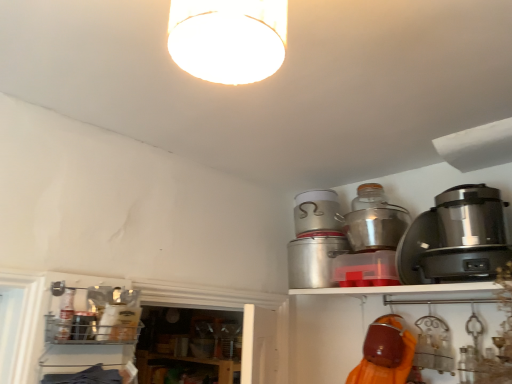
Question: Considering the relative positions of brushed metal canister at lower left, the fourth appliance viewed from the right, and metallic silver pot at upper center, the 2th appliance positioned from the right, in the image provided, is brushed metal canister at lower left, the fourth appliance viewed from the right, to the right of metallic silver pot at upper center, the 2th appliance positioned from the right, from the viewer's perspective?

Choices:
 (A) no
 (B) yes

Answer: (A)

Question: Is brushed metal canister at lower left, placed as the 1th appliance when sorted from left to right, placed right next to metallic silver pot at upper center, which is the third appliance from left to right?

Choices:
 (A) no
 (B) yes

Answer: (A)

Question: Is brushed metal canister at lower left, the fourth appliance viewed from the right, positioned with its back to metallic silver pot at upper center, which is the third appliance from left to right?

Choices:
 (A) no
 (B) yes

Answer: (A)

Question: Is brushed metal canister at lower left, placed as the 1th appliance when sorted from left to right, thinner than metallic silver pot at upper center, the 2th appliance positioned from the right?

Choices:
 (A) no
 (B) yes

Answer: (B)

Question: Is there a large distance between brushed metal canister at lower left, the fourth appliance viewed from the right, and metallic silver pot at upper center, the 2th appliance positioned from the right?

Choices:
 (A) no
 (B) yes

Answer: (B)

Question: Does brushed metal canister at lower left, the fourth appliance viewed from the right, have a lesser height compared to metallic silver pot at upper center, the 2th appliance positioned from the right?

Choices:
 (A) no
 (B) yes

Answer: (B)

Question: Can you confirm if metallic silver pot at upper center, the 2th appliance positioned from the right, is taller than metallic silver pot at upper right, placed as the 1th appliance when sorted from right to left?

Choices:
 (A) no
 (B) yes

Answer: (A)

Question: Is metallic silver pot at upper center, the 2th appliance positioned from the right, smaller than metallic silver pot at upper right, which is the 4th appliance in left-to-right order?

Choices:
 (A) no
 (B) yes

Answer: (B)

Question: Is metallic silver pot at upper center, the 2th appliance positioned from the right, to the left of metallic silver pot at upper right, which is the 4th appliance in left-to-right order, from the viewer's perspective?

Choices:
 (A) no
 (B) yes

Answer: (B)

Question: Would you consider metallic silver pot at upper center, which is the third appliance from left to right, to be distant from metallic silver pot at upper right, placed as the 1th appliance when sorted from right to left?

Choices:
 (A) no
 (B) yes

Answer: (A)

Question: Is metallic silver pot at upper center, which is the third appliance from left to right, positioned with its back to metallic silver pot at upper right, placed as the 1th appliance when sorted from right to left?

Choices:
 (A) no
 (B) yes

Answer: (A)

Question: From the image's perspective, is metallic silver pot at upper center, which is the third appliance from left to right, located beneath metallic silver pot at upper right, placed as the 1th appliance when sorted from right to left?

Choices:
 (A) no
 (B) yes

Answer: (A)

Question: From a real-world perspective, is metallic silver pot at upper center, the 2th appliance positioned from the right, positioned under metallic silver canister at upper right, the second appliance from the left, based on gravity?

Choices:
 (A) yes
 (B) no

Answer: (B)